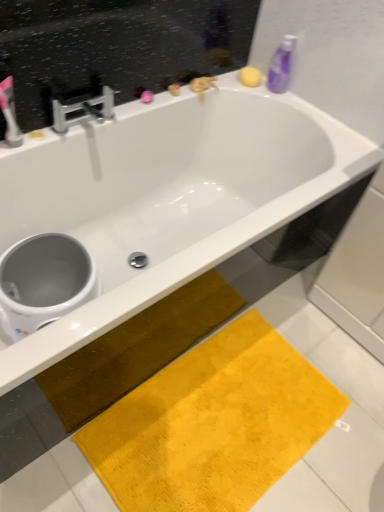
This screenshot has height=512, width=384. Find the location of `free spot behind yellow plush bath mat at lower center`. free spot behind yellow plush bath mat at lower center is located at coordinates (259, 304).